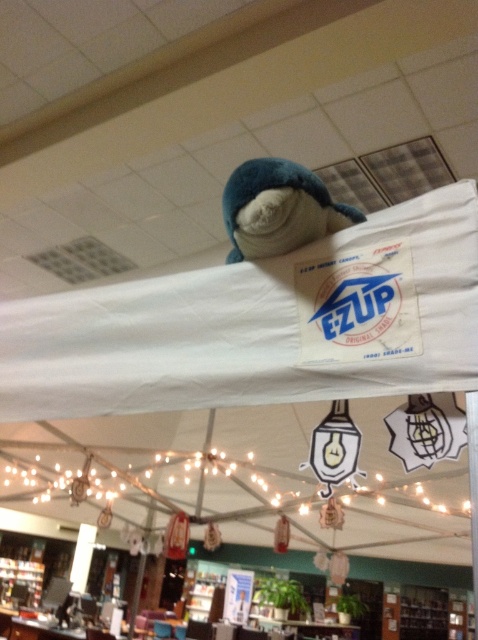
Question: Which point appears farthest from the camera in this image?

Choices:
 (A) tap(230, 209)
 (B) tap(191, 289)

Answer: (B)

Question: Does white fabric canopy at upper center have a lesser width compared to soft blue plush at upper center?

Choices:
 (A) yes
 (B) no

Answer: (B)

Question: Is white fabric canopy at upper center positioned in front of soft blue plush at upper center?

Choices:
 (A) no
 (B) yes

Answer: (B)

Question: Where is white fabric canopy at upper center located in relation to soft blue plush at upper center in the image?

Choices:
 (A) left
 (B) right

Answer: (A)